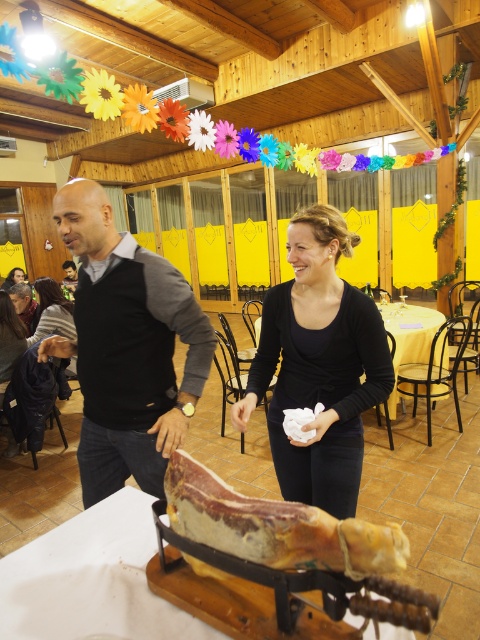
You are a guest at this event and want to pick up the wooden carved leg of ham at center to serve yourself. However, you are currently standing next to the dark brown hair at lower left. Can you reach the ham without moving your feet?

The wooden carved leg of ham at center and dark brown hair at lower left are 8.59 feet apart from each other. Since 8.59 feet is a significant distance, you would not be able to reach the ham without moving your feet.

You are a guest at this event and want to grab the raw cured meat at center. Can you reach it without moving the dark gray sweater at left?

The dark gray sweater at left is above the raw cured meat at center, so you would need to move or adjust the dark gray sweater at left to access the raw cured meat at center.

You are at the event and want to take a photo of the wooden carved leg of ham at center. Where should you position yourself to capture it in the frame?

The wooden carved leg of ham at center is located at point (93,580), so you should position yourself facing the center of the image to capture it in the frame.